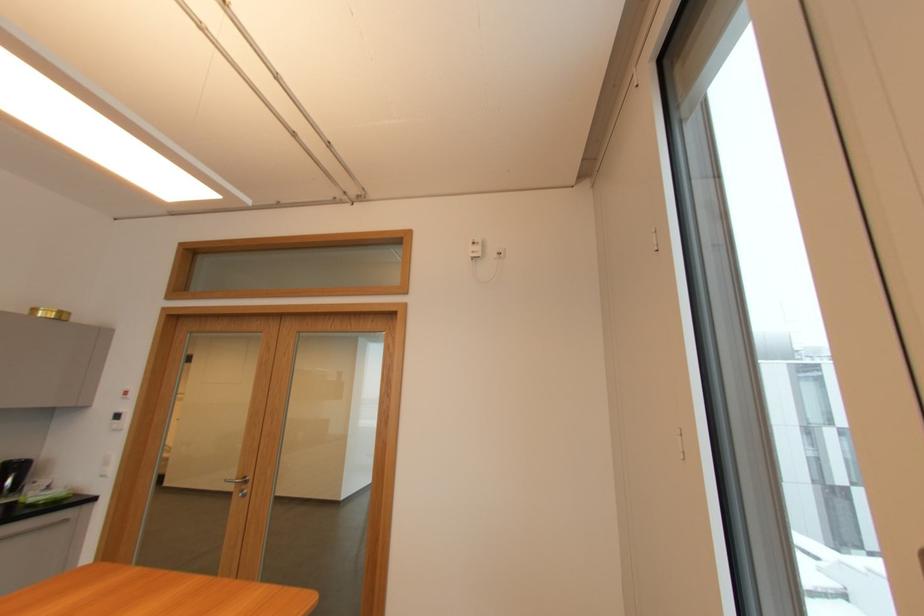
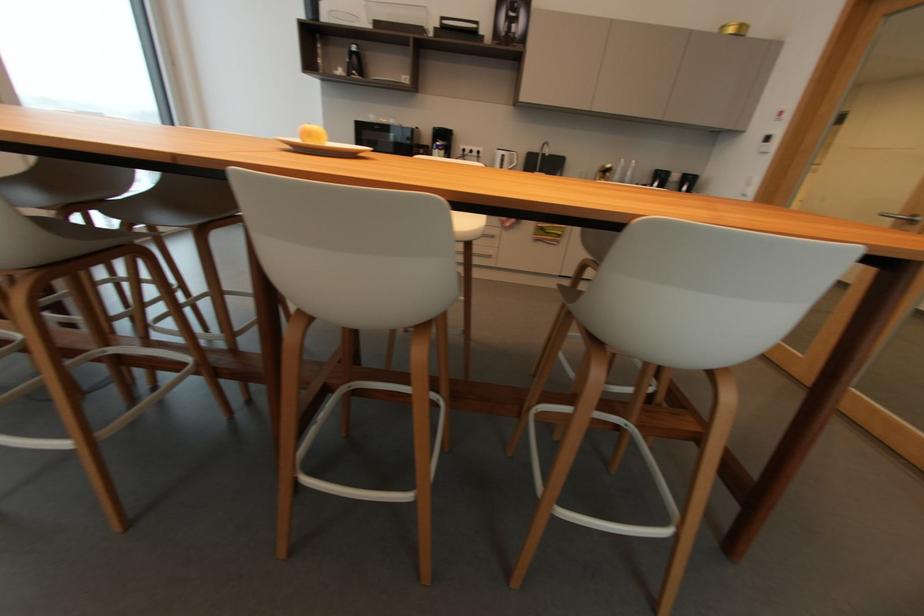
Based on the continuous images, in which direction is the camera rotating?

The camera's rotation is toward left-down.